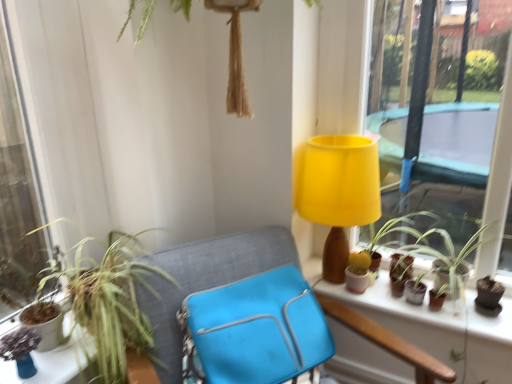
Where is `free spot to the right of matte white flowerpot at right, the 2th flowerpot when ordered from right to left`? The width and height of the screenshot is (512, 384). free spot to the right of matte white flowerpot at right, the 2th flowerpot when ordered from right to left is located at coordinates (398, 284).